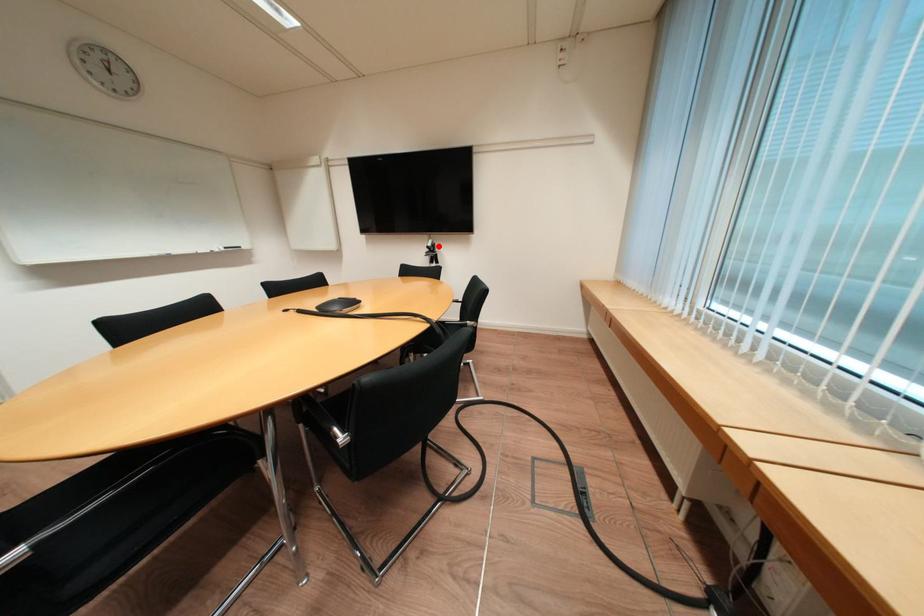
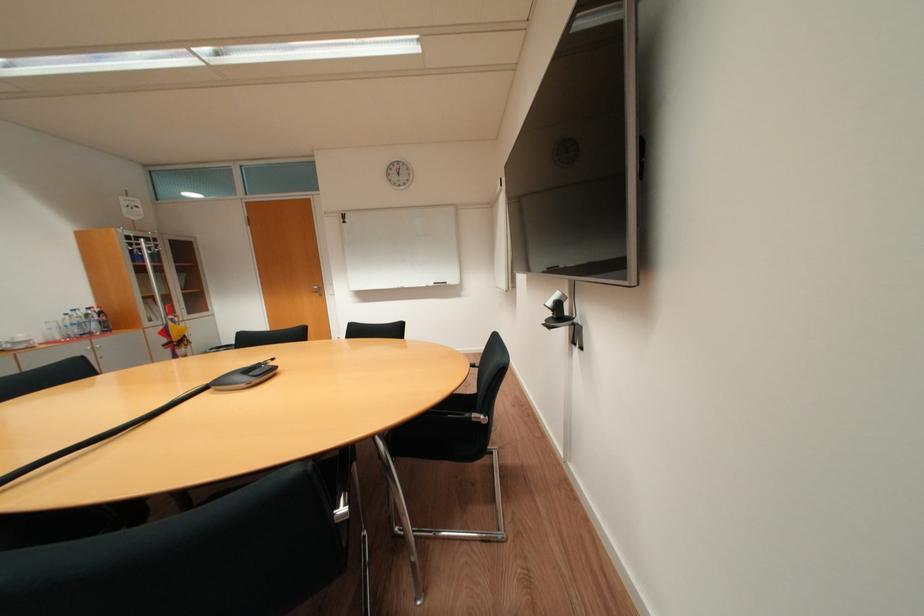
Question: I am providing you with two images of the same scene from different viewpoints. Given a red point in image1, look at the same physical point in image2. Is it:

Choices:
 (A) Closer to the viewpoint
 (B) Farther from the viewpoint

Answer: (B)